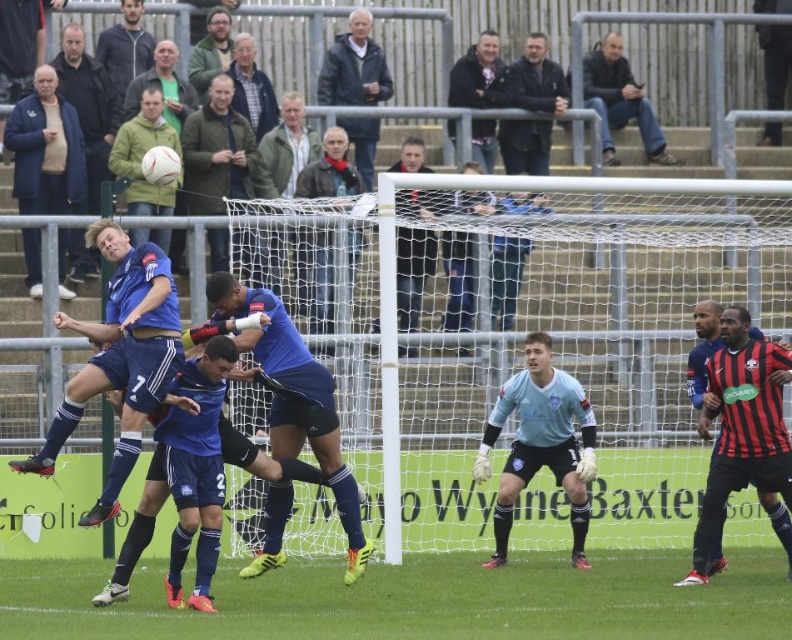
Question: Which point is farther to the camera?

Choices:
 (A) (537, 83)
 (B) (360, 13)

Answer: (A)

Question: Which object is farther from the camera taking this photo?

Choices:
 (A) dark blue leather jacket at upper center
 (B) green textured jacket at upper center
 (C) white mesh net at center

Answer: (A)

Question: Estimate the real-world distances between objects in this image. Which object is closer to the white mesh net at center?

Choices:
 (A) dark blue leather jacket at upper center
 (B) dark blue jacket at upper center

Answer: (A)

Question: Does green textured jacket at center have a smaller size compared to dark blue jacket at upper center?

Choices:
 (A) yes
 (B) no

Answer: (B)

Question: Does white mesh net at center have a larger size compared to dark blue jacket at upper center?

Choices:
 (A) yes
 (B) no

Answer: (A)

Question: Can you confirm if dark blue leather jacket at upper center is wider than light brown leather jacket at upper center?

Choices:
 (A) yes
 (B) no

Answer: (A)